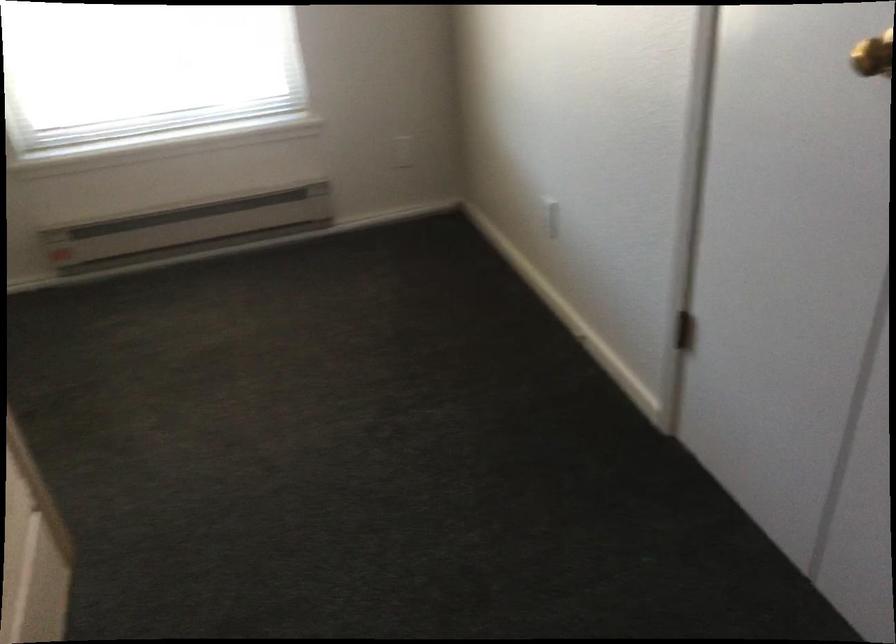
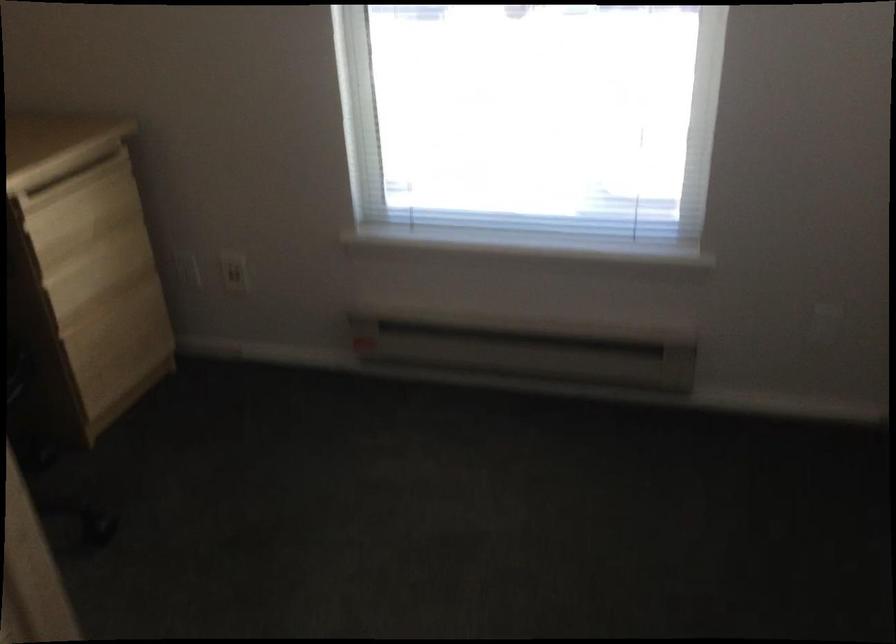
Question: The camera is either moving clockwise (left) or counter-clockwise (right) around the object. The first image is from the beginning of the video and the second image is from the end. Is the camera moving left or right when shooting the video?

Choices:
 (A) Left
 (B) Right

Answer: (B)